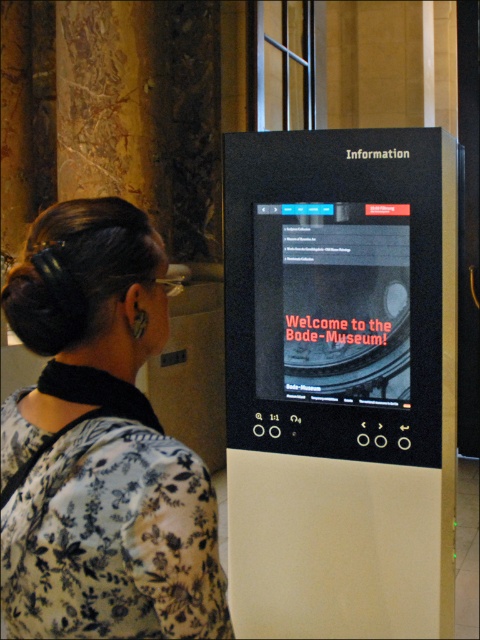
What do you see at coordinates (340, 381) in the screenshot?
I see `black plastic information kiosk at center` at bounding box center [340, 381].

Who is more forward, [324,192] or [142,362]?

Point [142,362] is in front.

What do you see at coordinates (340, 381) in the screenshot? I see `black plastic information kiosk at center` at bounding box center [340, 381].

Where is `black plastic information kiosk at center`? The image size is (480, 640). black plastic information kiosk at center is located at coordinates (340, 381).